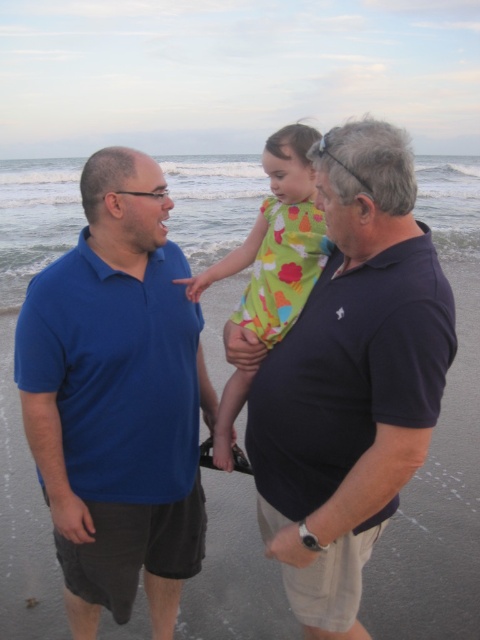
Question: Which object is farther from the camera taking this photo?

Choices:
 (A) green floral dress at center
 (B) matte blue polo shirt at left

Answer: (B)

Question: Is matte blue polo shirt at left wider than dark blue cotton shirt at center?

Choices:
 (A) yes
 (B) no

Answer: (A)

Question: Among these points, which one is farthest from the camera?

Choices:
 (A) (290, 180)
 (B) (360, 278)
 (C) (108, 240)

Answer: (A)

Question: Where is matte blue polo shirt at left located in relation to dark blue cotton shirt at center in the image?

Choices:
 (A) above
 (B) below

Answer: (B)

Question: Which point is closer to the camera?

Choices:
 (A) (289, 198)
 (B) (132, 180)

Answer: (B)

Question: Considering the relative positions of matte blue polo shirt at left and dark blue cotton shirt at center in the image provided, where is matte blue polo shirt at left located with respect to dark blue cotton shirt at center?

Choices:
 (A) above
 (B) below

Answer: (B)